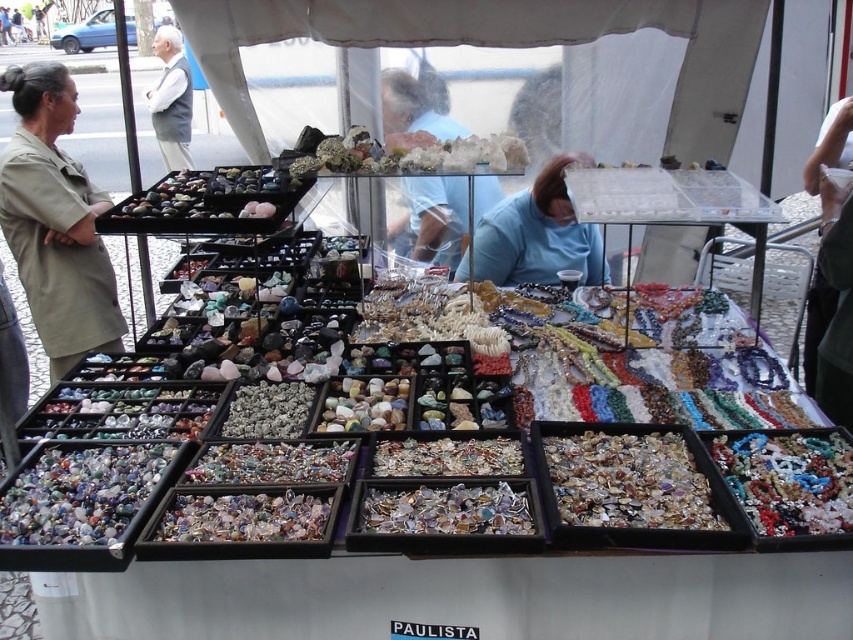
Question: In this image, where is beige uniform at left located relative to white vest at upper left?

Choices:
 (A) right
 (B) left

Answer: (A)

Question: Among these objects, which one is nearest to the camera?

Choices:
 (A) white vest at upper left
 (B) beige uniform at left
 (C) blue fabric at center

Answer: (B)

Question: Which object is positioned farthest from the white vest at upper left?

Choices:
 (A) beige uniform at left
 (B) blue fabric at center

Answer: (B)

Question: Can you confirm if beige uniform at left is thinner than white vest at upper left?

Choices:
 (A) yes
 (B) no

Answer: (A)

Question: Based on their relative distances, which object is nearer to the beige uniform at left?

Choices:
 (A) white vest at upper left
 (B) blue fabric at center

Answer: (B)

Question: Is blue fabric at center thinner than white vest at upper left?

Choices:
 (A) yes
 (B) no

Answer: (B)